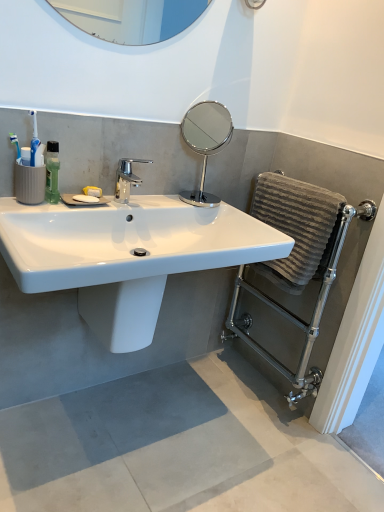
Question: Would you say gray textured towel at right is outside white glossy sink at center?

Choices:
 (A) no
 (B) yes

Answer: (B)

Question: From a real-world perspective, is gray textured towel at right below white glossy sink at center?

Choices:
 (A) yes
 (B) no

Answer: (A)

Question: Considering the relative sizes of gray textured towel at right and white glossy sink at center in the image provided, is gray textured towel at right thinner than white glossy sink at center?

Choices:
 (A) yes
 (B) no

Answer: (A)

Question: Is the position of gray textured towel at right less distant than that of white glossy sink at center?

Choices:
 (A) yes
 (B) no

Answer: (B)

Question: Considering the relative sizes of gray textured towel at right and white glossy sink at center in the image provided, is gray textured towel at right taller than white glossy sink at center?

Choices:
 (A) yes
 (B) no

Answer: (A)

Question: Could you tell me if gray textured towel at right is turned towards white glossy sink at center?

Choices:
 (A) no
 (B) yes

Answer: (B)

Question: Is white glossy bidet at center wider than polished chrome mirror at center?

Choices:
 (A) yes
 (B) no

Answer: (A)

Question: Does white glossy bidet at center appear on the right side of polished chrome mirror at center?

Choices:
 (A) yes
 (B) no

Answer: (B)

Question: Can you confirm if white glossy bidet at center is taller than polished chrome mirror at center?

Choices:
 (A) no
 (B) yes

Answer: (A)

Question: Considering the relative positions of white glossy bidet at center and polished chrome mirror at center in the image provided, is white glossy bidet at center to the left of polished chrome mirror at center from the viewer's perspective?

Choices:
 (A) no
 (B) yes

Answer: (B)

Question: Is white glossy bidet at center not inside polished chrome mirror at center?

Choices:
 (A) no
 (B) yes

Answer: (B)

Question: Is white glossy bidet at center smaller than polished chrome mirror at center?

Choices:
 (A) no
 (B) yes

Answer: (A)

Question: Can you confirm if gray concrete floor at lower center is positioned to the right of polished chrome mirror at center?

Choices:
 (A) yes
 (B) no

Answer: (B)